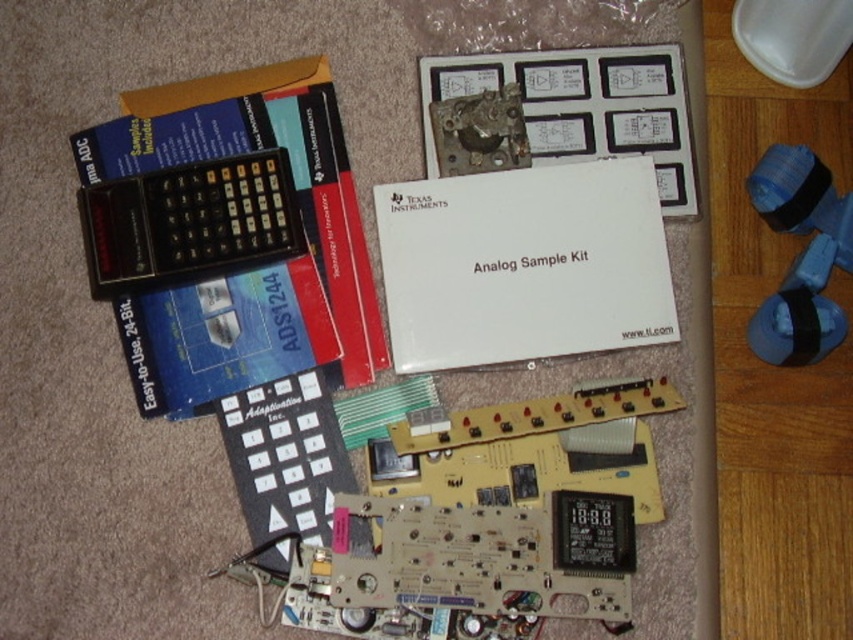
You are setting up an electronic project and need to place the metallic silver circuit board at upper center and the black plastic remote at center on a small table. Which object should you place first to ensure both fit on the table?

The metallic silver circuit board at upper center is larger in size than the black plastic remote at center, so you should place it first to ensure both fit on the table.

You are organizing the items on the floor and need to stack the black paper at upper left and the black plastic calculator at upper left. Which item should you place at the bottom of the stack to ensure stability?

The black paper at upper left is taller than the black plastic calculator at upper left, so placing the black paper at upper left at the bottom would provide a stable base due to its greater height.